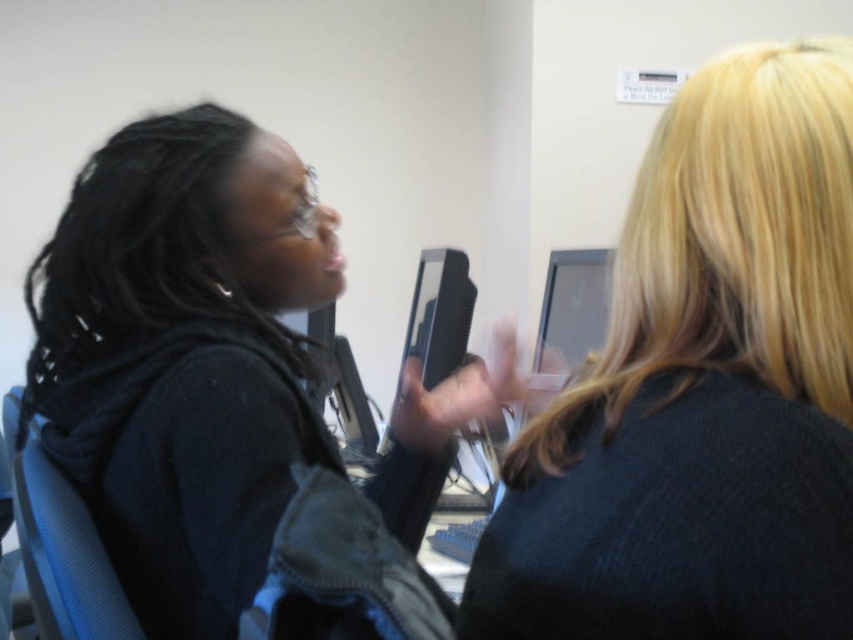
Does black matte jacket at center have a greater width compared to blue fabric chair at left?

Correct, the width of black matte jacket at center exceeds that of blue fabric chair at left.

Which is below, black matte jacket at center or blue fabric chair at left?

blue fabric chair at left

Between point (68, 323) and point (79, 522), which one is positioned in front?

Positioned in front is point (79, 522).

Locate an element on the screen. black matte jacket at center is located at coordinates (183, 355).

Can you confirm if black matte jacket at center is smaller than matte black monitor at center?

No, black matte jacket at center is not smaller than matte black monitor at center.

Does black matte jacket at center appear on the right side of matte black monitor at center?

No, black matte jacket at center is not to the right of matte black monitor at center.

Locate an element on the screen. black matte jacket at center is located at coordinates (183, 355).

Is blue fabric chair at left positioned before matte black monitor at center?

Yes, it is in front of matte black monitor at center.

Which of these two, blue fabric chair at left or matte black monitor at center, stands shorter?

blue fabric chair at left

What are the coordinates of `blue fabric chair at left` in the screenshot? It's located at (61, 547).

In order to click on blue fabric chair at left in this screenshot , I will do `click(61, 547)`.